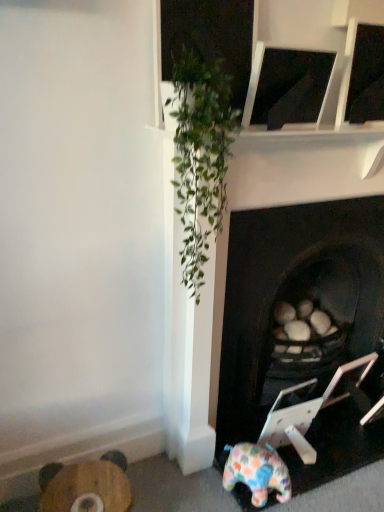
Question: Considering the positions of multicolored plush elephant at lower right and wooden stool at lower left in the image, is multicolored plush elephant at lower right wider or thinner than wooden stool at lower left?

Choices:
 (A) wide
 (B) thin

Answer: (A)

Question: Based on their sizes in the image, would you say multicolored plush elephant at lower right is bigger or smaller than wooden stool at lower left?

Choices:
 (A) big
 (B) small

Answer: (B)

Question: Estimate the real-world distances between objects in this image. Which object is farther from the dark wood fireplace at center?

Choices:
 (A) multicolored plush elephant at lower right
 (B) wooden stool at lower left

Answer: (B)

Question: Estimate the real-world distances between objects in this image. Which object is closer to the wooden stool at lower left?

Choices:
 (A) dark wood fireplace at center
 (B) multicolored plush elephant at lower right

Answer: (B)